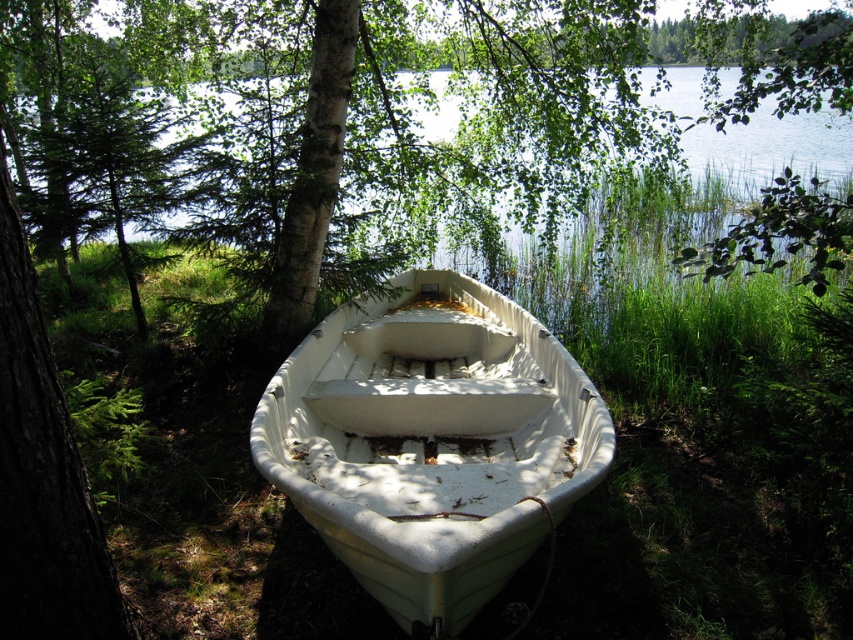
Question: Which point is farther to the camera?

Choices:
 (A) (682, 115)
 (B) (535, 508)

Answer: (A)

Question: Can you confirm if white matte boat at center is positioned below transparent water at center?

Choices:
 (A) no
 (B) yes

Answer: (B)

Question: Can you confirm if white matte boat at center is positioned to the left of transparent water at center?

Choices:
 (A) yes
 (B) no

Answer: (A)

Question: Is white matte boat at center wider than transparent water at center?

Choices:
 (A) no
 (B) yes

Answer: (A)